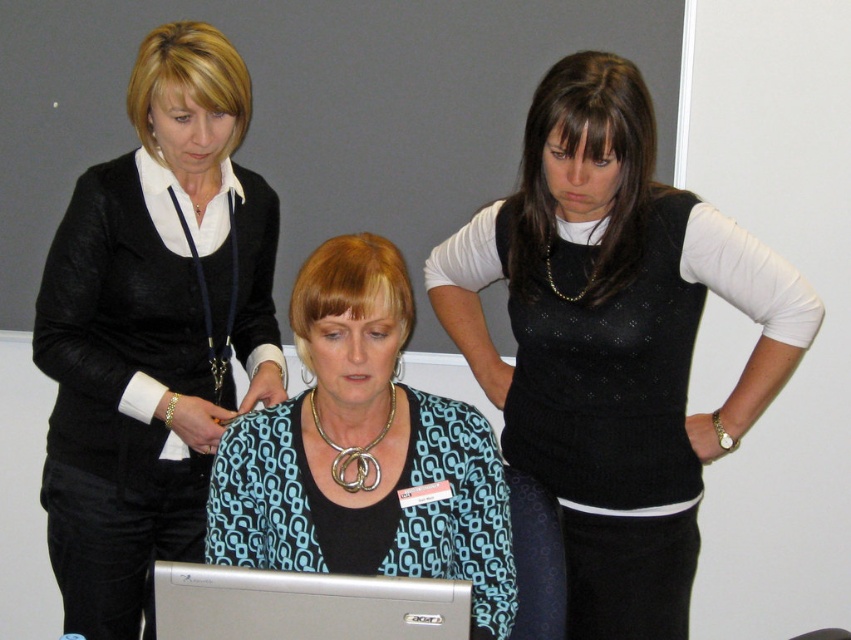
Based on the photo, who is taller, black matte blazer at upper left or blue patterned blouse at center?

With more height is black matte blazer at upper left.

Is black matte blazer at upper left to the right of blue patterned blouse at center from the viewer's perspective?

Incorrect, black matte blazer at upper left is not on the right side of blue patterned blouse at center.

The image size is (851, 640). I want to click on black matte blazer at upper left, so (x=153, y=330).

At what (x,y) coordinates should I click in order to perform the action: click on black matte blazer at upper left. Please return your answer as a coordinate pair (x, y). The width and height of the screenshot is (851, 640). Looking at the image, I should click on (153, 330).

Between black knitted vest at center and black matte blazer at upper left, which one has more height?

black matte blazer at upper left

Is black knitted vest at center further to the viewer compared to black matte blazer at upper left?

No, black knitted vest at center is in front of black matte blazer at upper left.

Locate an element on the screen. black knitted vest at center is located at coordinates (614, 340).

I want to click on black knitted vest at center, so click(x=614, y=340).

Can you confirm if black knitted vest at center is taller than blue patterned blouse at center?

Correct, black knitted vest at center is much taller as blue patterned blouse at center.

Which is more to the left, black knitted vest at center or blue patterned blouse at center?

Positioned to the left is blue patterned blouse at center.

Is point (517, 269) closer to viewer compared to point (311, 458)?

That is False.

At what (x,y) coordinates should I click in order to perform the action: click on black knitted vest at center. Please return your answer as a coordinate pair (x, y). Looking at the image, I should click on click(x=614, y=340).